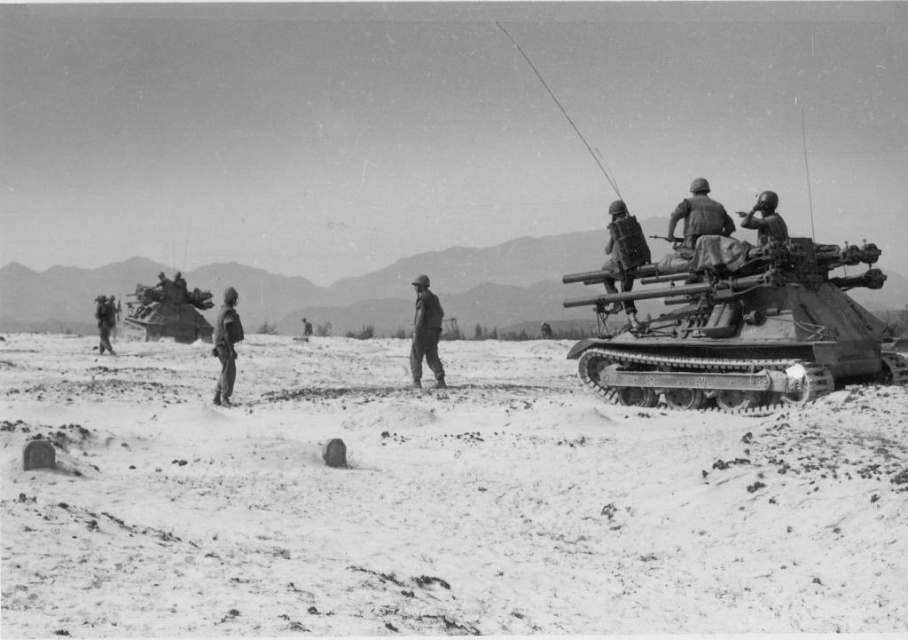
Question: Which point is closer to the camera taking this photo?

Choices:
 (A) (758, 198)
 (B) (104, 337)
 (C) (698, 394)

Answer: (C)

Question: Is metallic tank at right positioned before matte black helmet at center?

Choices:
 (A) yes
 (B) no

Answer: (A)

Question: Which of these objects is positioned farthest from the metallic helmet at upper right?

Choices:
 (A) camouflage fabric uniform at center
 (B) camouflage fabric helmet at left

Answer: (B)

Question: Does metallic helmet at upper right appear on the left side of camouflage fabric helmet at left?

Choices:
 (A) yes
 (B) no

Answer: (B)

Question: Where is shiny metallic tank at left located in relation to camouflage fabric uniform at center in the image?

Choices:
 (A) left
 (B) right

Answer: (A)

Question: Among these points, which one is farthest from the camera?

Choices:
 (A) (238, 317)
 (B) (745, 225)
 (C) (107, 324)

Answer: (C)